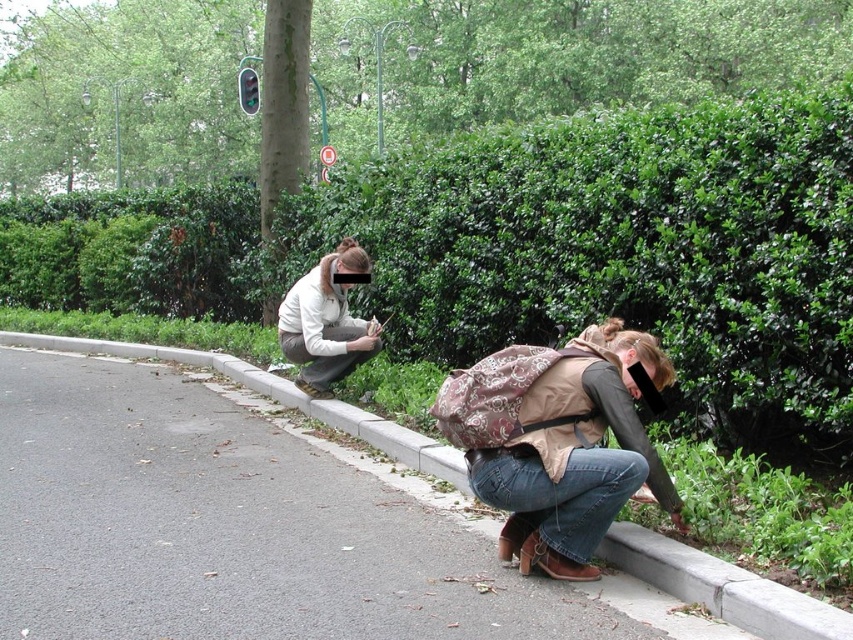
Question: Which point is farther to the camera?

Choices:
 (A) (300, 333)
 (B) (579, 401)
 (C) (582, 497)

Answer: (A)

Question: Is concrete at lower center behind white matte jacket at upper left?

Choices:
 (A) yes
 (B) no

Answer: (B)

Question: From the image, what is the correct spatial relationship of green leafy hedge at upper center in relation to concrete at lower center?

Choices:
 (A) left
 (B) right

Answer: (A)

Question: Among these objects, which one is nearest to the camera?

Choices:
 (A) concrete at lower center
 (B) brown floral backpack at center

Answer: (A)

Question: Which point is farther to the camera?

Choices:
 (A) (570, 484)
 (B) (500, 208)

Answer: (B)

Question: Is brown floral backpack at center smaller than brown fabric backpack at lower center?

Choices:
 (A) yes
 (B) no

Answer: (B)